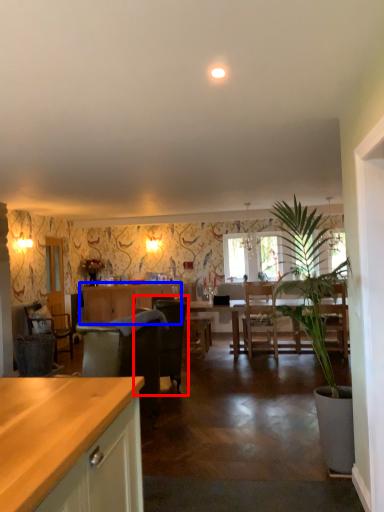
Question: Which object is closer to the camera taking this photo, chair (highlighted by a red box) or cabinetry (highlighted by a blue box)?

Choices:
 (A) chair
 (B) cabinetry

Answer: (A)